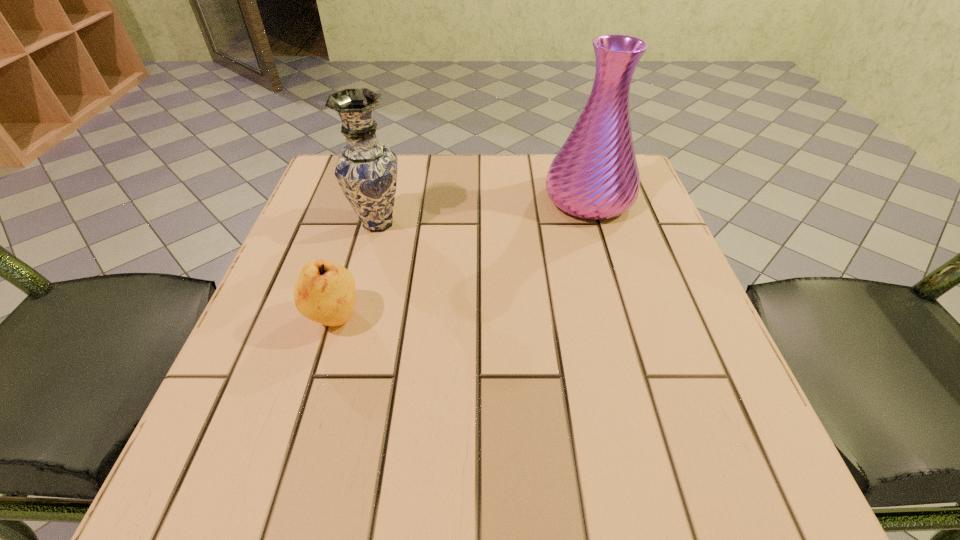
Find the location of a particular element. vacant space at the near right corner is located at coordinates (647, 435).

Where is `unoccupied position between the second shortest object and the right vase`? The height and width of the screenshot is (540, 960). unoccupied position between the second shortest object and the right vase is located at coordinates 484,212.

Image resolution: width=960 pixels, height=540 pixels. Find the location of `vacant space that is in between the taller vase and the pear`. vacant space that is in between the taller vase and the pear is located at coordinates (462, 259).

At what (x,y) coordinates should I click in order to perform the action: click on free space between the tallest object and the second shortest object. Please return your answer as a coordinate pair (x, y). The height and width of the screenshot is (540, 960). Looking at the image, I should click on (484, 212).

Locate an element on the screen. vacant region between the second shortest object and the nearest object is located at coordinates (356, 271).

Locate an element on the screen. The width and height of the screenshot is (960, 540). free area in between the shorter vase and the tallest object is located at coordinates (484, 212).

Locate an element on the screen. This screenshot has width=960, height=540. vacant point located between the nearest object and the taller vase is located at coordinates (462, 259).

The width and height of the screenshot is (960, 540). I want to click on vacant space that is in between the rightmost object and the shortest object, so click(x=462, y=259).

What are the coordinates of `empty space between the left vase and the tallest object` in the screenshot? It's located at (484, 212).

You are a GUI agent. You are given a task and a screenshot of the screen. Output one action in this format:
    pyautogui.click(x=<x>, y=<y>)
    Task: Click on the free space that is in between the shorter vase and the nearest object
    This screenshot has width=960, height=540.
    Given the screenshot: What is the action you would take?
    pyautogui.click(x=356, y=271)